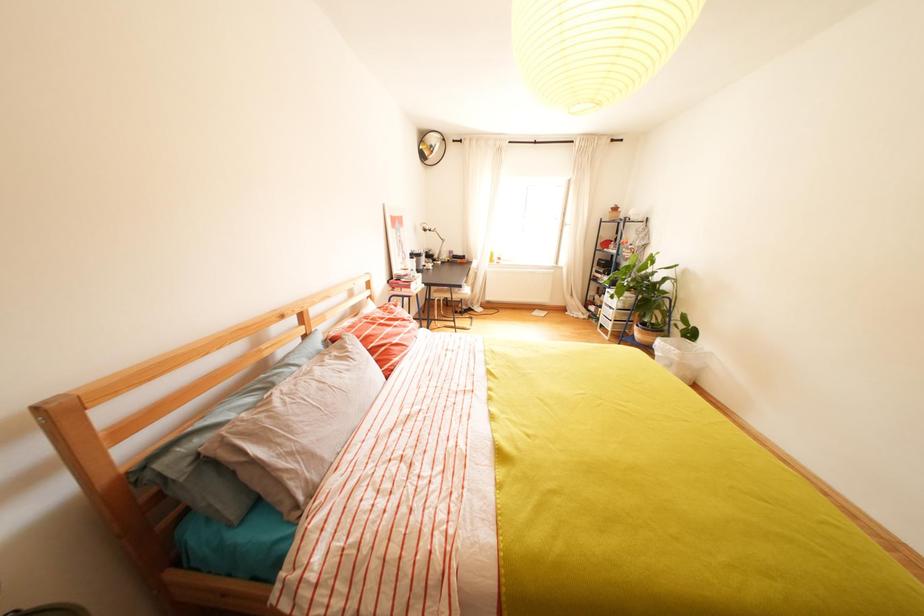
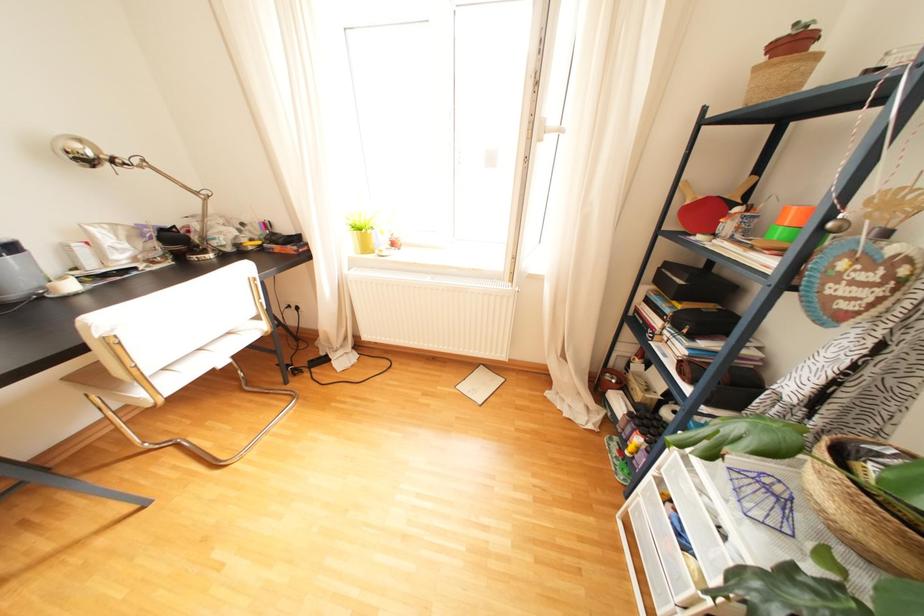
Which direction would the cameraman need to move to produce the second image?

The movement direction of the cameraman is right, forward.